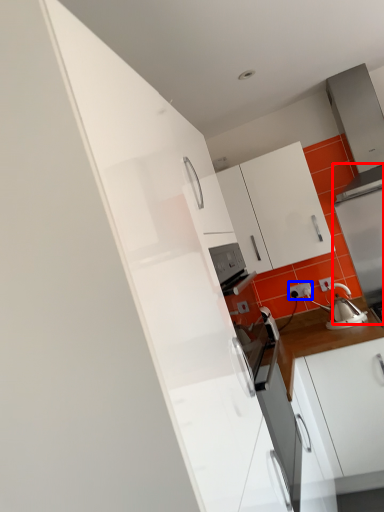
Question: Which of the following is the closest to the observer, appliance (highlighted by a red box) or electric outlet (highlighted by a blue box)?

Choices:
 (A) appliance
 (B) electric outlet

Answer: (A)